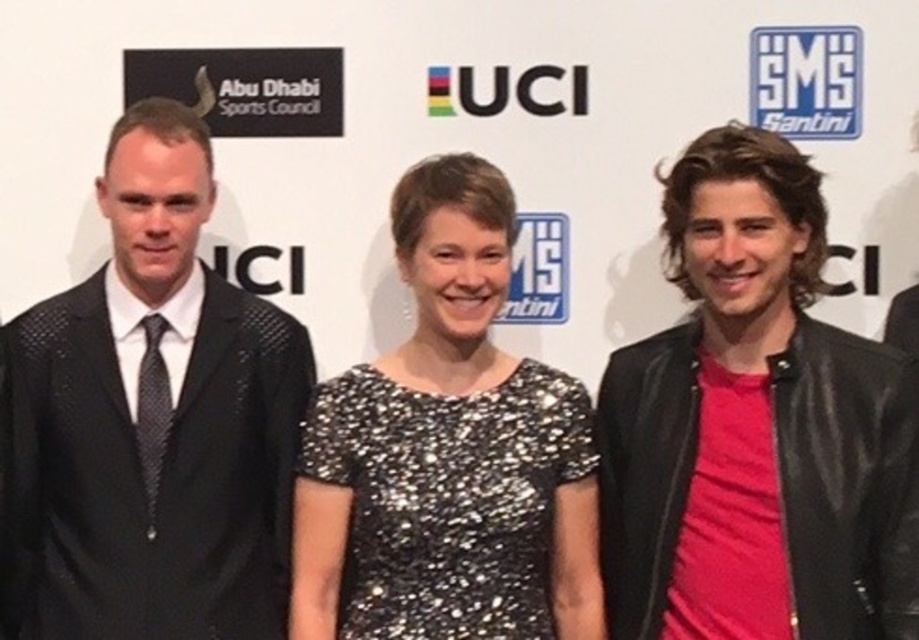
Find the location of a particular element. black textured suit at left is located at coordinates (149, 422).

Can you confirm if black textured suit at left is positioned below sparkly black dress at center?

No, black textured suit at left is not below sparkly black dress at center.

Between point (125, 232) and point (509, 611), which one is positioned behind?

The point (125, 232) is behind.

Locate an element on the screen. black textured suit at left is located at coordinates (149, 422).

Where is `red leather jacket at right`? The height and width of the screenshot is (640, 919). red leather jacket at right is located at coordinates (755, 428).

Identify the location of red leather jacket at right. The height and width of the screenshot is (640, 919). (755, 428).

Does point (892, 436) come in front of point (95, 454)?

Yes, point (892, 436) is in front of point (95, 454).

Between red leather jacket at right and black textured suit at left, which one appears on the left side from the viewer's perspective?

Positioned to the left is black textured suit at left.

Where is `red leather jacket at right`? This screenshot has height=640, width=919. red leather jacket at right is located at coordinates (755, 428).

Where is `red leather jacket at right`? red leather jacket at right is located at coordinates (755, 428).